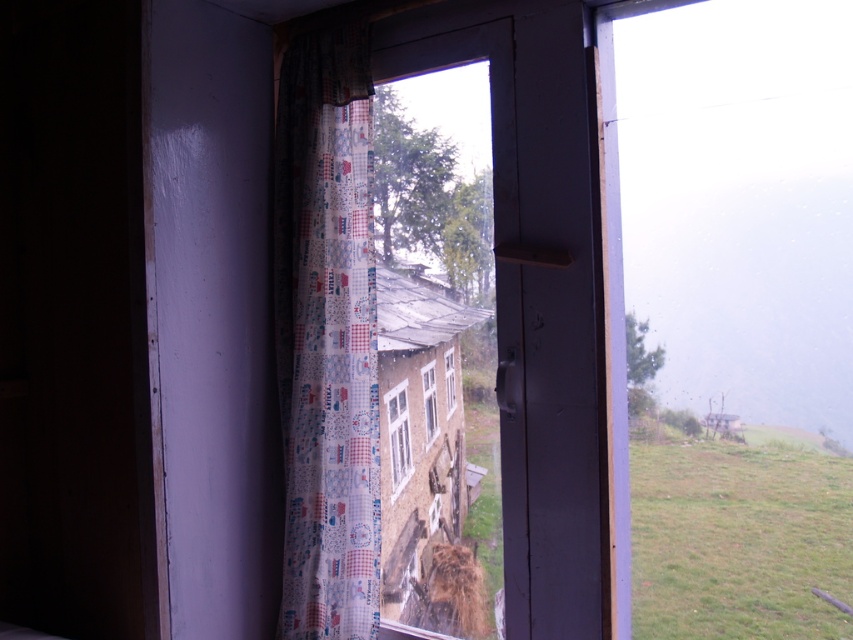
You are an interior designer assessing the room layout. You need to determine if the printed fabric curtain at left can be raised to fully expose the transparent plastic window at center. Based on their heights, can the curtain be raised enough to do so?

The printed fabric curtain at left has a greater height compared to the transparent plastic window at center. This means the curtain is taller than the window, so raising it might leave parts of the window still covered by the curtain material. However, if the curtain is raised to its maximum height, it may still allow the transparent plastic window at center to be fully exposed depending on how much it can be lifted. Without specific measurements of how high the curtain can be raised, it is uncertain. But,

You are standing in the room looking through the window. There is a point marked at coordinates (326, 336). What object is located at that point?

The point at coordinates (326, 336) marks the printed fabric curtain at left.

You are a photographer standing in the room with a camera. You want to take a photo of the printed fabric curtain at left while also capturing the view outside the window. Since the curtain is partially blocking the view, can you move closer to the camera to get both the curtain and the outdoor scene in focus?

The printed fabric curtain at left is 1.73 meters from camera. Moving closer to the camera would decrease the distance between you and the curtain, potentially allowing both the curtain and the distant outdoor scene to be in focus if the depth of field is sufficient. However, since the curtain is already 1.73 meters away, moving closer might require adjusting the camera settings or using a smaller aperture for greater depth of field to ensure both subjects are sharp.